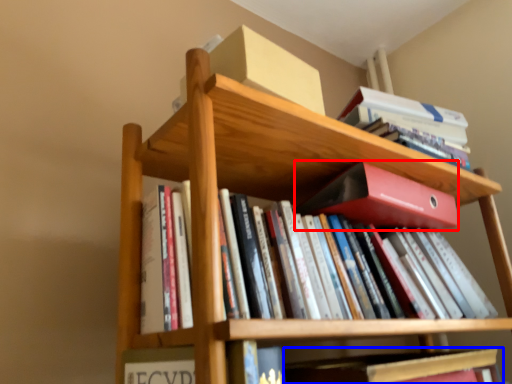
Question: Which point is closer to the camera, paperback book (highlighted by a red box) or book (highlighted by a blue box)?

Choices:
 (A) paperback book
 (B) book

Answer: (B)